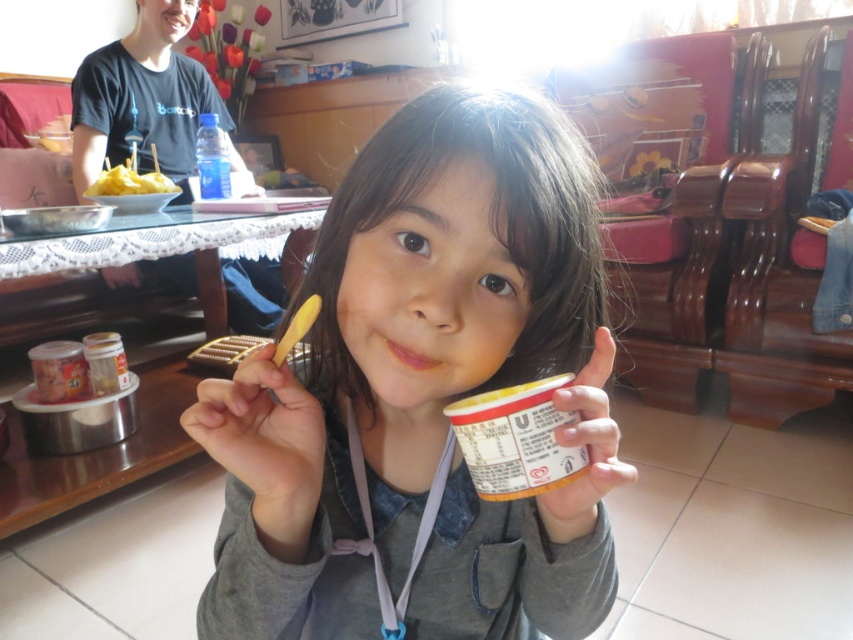
Question: Which point is closer to the camera taking this photo?

Choices:
 (A) (222, 611)
 (B) (167, 193)

Answer: (A)

Question: In this image, where is matte gray sweater at center located relative to yellow matte food at left?

Choices:
 (A) above
 (B) below

Answer: (B)

Question: Is matte gray sweater at center below yellow matte food at left?

Choices:
 (A) yes
 (B) no

Answer: (A)

Question: Does matte gray sweater at center appear on the left side of yellow matte food at left?

Choices:
 (A) no
 (B) yes

Answer: (A)